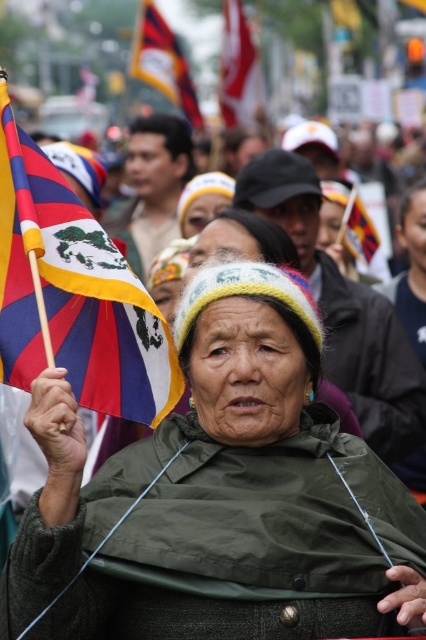
You are a photographer trying to capture the elderly woman in the center of the frame. The green knitted hat at upper center and the polyester flag at left are both in your view. Based on their positions, which object is wider from your perspective?

The green knitted hat at upper center might be wider than polyester flag at left according to the description.

You are a photographer trying to capture the green knitted hat at upper center in your shot. Based on the coordinates provided, where exactly should you focus your camera lens to ensure the hat is centered in the image?

To center the green knitted hat at upper center in your image, focus your camera lens precisely at the coordinates point (215,496).

You are a photographer trying to capture the elderly woman holding the polyester flag at left and the red fabric flag at upper right in the same frame. Which flag will appear larger in the photo?

The polyester flag at left appears larger in the photo because it is closer to the viewer than the red fabric flag at upper right.